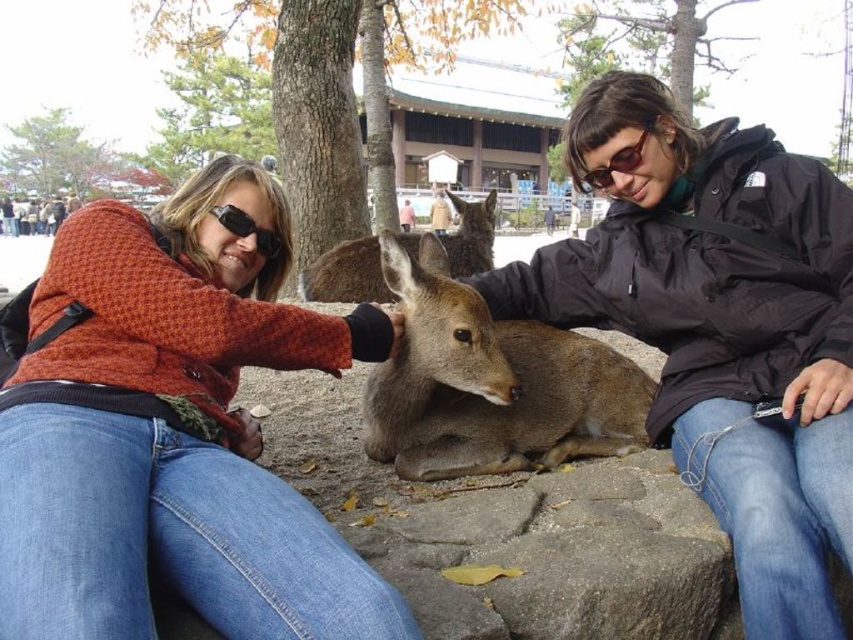
You are a photographer trying to capture a clear shot of the brown fur deer at center and the matte black sunglasses at center. Based on their positions, which object is closer to the camera?

The brown fur deer at center is located above the matte black sunglasses at center, meaning it is closer to the camera.

You are standing in the park and see two points marked in the image. Which point is closer to you, point (796, 160) or point (242, 212)?

Point (796, 160) is further to the viewer than point (242, 212), so point (242, 212) is closer to you.